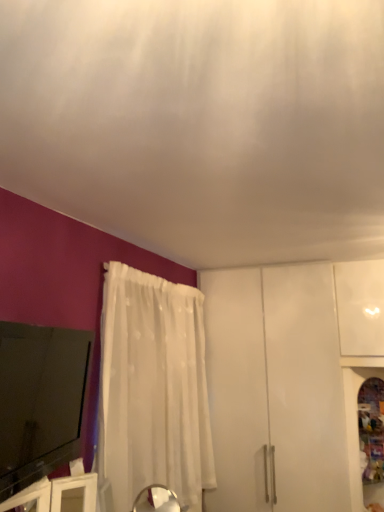
In order to click on white sheer curtain at lower center in this screenshot , I will do `click(201, 124)`.

Identify the location of black glossy tv at lower left. (39, 400).

How far apart are white sheer curtain at lower center and black glossy tv at lower left?

A distance of 31.93 inches exists between white sheer curtain at lower center and black glossy tv at lower left.

Would you say white sheer curtain at lower center is outside black glossy tv at lower left?

Absolutely, white sheer curtain at lower center is external to black glossy tv at lower left.

Considering the relative sizes of white sheer curtain at lower center and black glossy tv at lower left in the image provided, is white sheer curtain at lower center taller than black glossy tv at lower left?

Incorrect, the height of white sheer curtain at lower center is not larger of that of black glossy tv at lower left.

Is white sheer curtain at lower center far away from black glossy tv at lower left?

No, white sheer curtain at lower center is not far from black glossy tv at lower left.

Consider the image. Measure the distance from white sheer curtain at left to white sheer curtain at lower center.

white sheer curtain at left and white sheer curtain at lower center are 1.08 meters apart from each other.

Is point (158, 358) less distant than point (341, 61)?

No.

Is white sheer curtain at left positioned behind white sheer curtain at lower center?

Yes.

Which object is wider, white sheer curtain at left or white sheer curtain at lower center?

white sheer curtain at lower center.

Between white sheer curtain at lower center and white sheer curtain at left, which one appears on the right side from the viewer's perspective?

Positioned to the right is white sheer curtain at lower center.

From a real-world perspective, which object stands above the other?

white sheer curtain at lower center is physically above.

Based on the photo, how much distance is there between white sheer curtain at lower center and white sheer curtain at left?

The distance of white sheer curtain at lower center from white sheer curtain at left is 1.08 meters.

Can you confirm if white sheer curtain at lower center is smaller than white sheer curtain at left?

No, white sheer curtain at lower center is not smaller than white sheer curtain at left.

Considering the relative sizes of white glossy cabinet at lower right and black glossy tv at lower left in the image provided, is white glossy cabinet at lower right taller than black glossy tv at lower left?

Indeed, white glossy cabinet at lower right has a greater height compared to black glossy tv at lower left.

Is white glossy cabinet at lower right aimed at black glossy tv at lower left?

No, white glossy cabinet at lower right is not oriented towards black glossy tv at lower left.

Is white glossy cabinet at lower right in front of or behind black glossy tv at lower left in the image?

In the image, white glossy cabinet at lower right appears behind black glossy tv at lower left.

Considering the positions of point (4, 405) and point (354, 505), is point (4, 405) closer or farther from the camera than point (354, 505)?

Point (4, 405).

From their relative heights in the image, would you say black glossy tv at lower left is taller or shorter than white glossy cabinet at lower right?

black glossy tv at lower left is shorter than white glossy cabinet at lower right.

From a real-world perspective, relative to white glossy cabinet at lower right, is black glossy tv at lower left vertically above or below?

In terms of real-world spatial position, black glossy tv at lower left is above white glossy cabinet at lower right.

Can you tell me how much black glossy tv at lower left and white glossy cabinet at lower right differ in facing direction?

103 degrees.

I want to click on cabinetry that is behind the white sheer curtain at lower center, so click(x=355, y=428).

Which of these two, white glossy cabinet at lower right or white sheer curtain at lower center, is smaller?

white glossy cabinet at lower right is smaller.

Is white glossy cabinet at lower right oriented towards white sheer curtain at lower center?

No, white glossy cabinet at lower right does not turn towards white sheer curtain at lower center.

Can you tell me how much white glossy cabinet at lower right and white sheer curtain at lower center differ in facing direction?

2.49 degrees separate the facing orientations of white glossy cabinet at lower right and white sheer curtain at lower center.

Are black glossy tv at lower left and white sheer curtain at left making contact?

No, black glossy tv at lower left is not in contact with white sheer curtain at left.

Is black glossy tv at lower left turned away from white sheer curtain at left?

No, black glossy tv at lower left's orientation is not away from white sheer curtain at left.

Is point (78, 361) closer to camera compared to point (198, 333)?

Yes, it is.

Does black glossy tv at lower left have a lesser width compared to white sheer curtain at left?

Yes.

You are a GUI agent. You are given a task and a screenshot of the screen. Output one action in this format:
    pyautogui.click(x=<x>, y=<y>)
    Task: Click on the blind in front of the black glossy tv at lower left
    The image size is (384, 512).
    Given the screenshot: What is the action you would take?
    pyautogui.click(x=201, y=124)

There is a white sheer curtain at left. Where is `blind above it (from a real-world perspective)`? This screenshot has height=512, width=384. blind above it (from a real-world perspective) is located at coordinates (201, 124).

Based on their spatial positions, is white sheer curtain at left or white sheer curtain at lower center closer to black glossy tv at lower left?

white sheer curtain at left is positioned closer to the anchor black glossy tv at lower left.

From the image, which object appears to be nearer to white sheer curtain at left, white glossy cabinet at lower right or black glossy tv at lower left?

Among the two, black glossy tv at lower left is located nearer to white sheer curtain at left.

When comparing their distances from white sheer curtain at lower center, does white glossy cabinet at lower right or black glossy tv at lower left seem closer?

black glossy tv at lower left lies closer to white sheer curtain at lower center than the other object.

Considering their positions, is black glossy tv at lower left positioned further to white sheer curtain at left than white glossy cabinet at lower right?

The object further to white sheer curtain at left is white glossy cabinet at lower right.

Considering their positions, is white sheer curtain at lower center positioned further to black glossy tv at lower left than white sheer curtain at left?

The object further to black glossy tv at lower left is white sheer curtain at lower center.

From the image, which object appears to be nearer to white sheer curtain at left, white sheer curtain at lower center or white glossy cabinet at lower right?

white sheer curtain at lower center.

Considering their positions, is white sheer curtain at left positioned closer to white glossy cabinet at lower right than black glossy tv at lower left?

white sheer curtain at left is positioned closer to the anchor white glossy cabinet at lower right.

From the image, which object appears to be farther from white sheer curtain at lower center, white glossy cabinet at lower right or white sheer curtain at left?

white glossy cabinet at lower right.

The height and width of the screenshot is (512, 384). I want to click on curtain located between white sheer curtain at lower center and white glossy cabinet at lower right in the depth direction, so click(x=152, y=389).

Locate an element on the screen. This screenshot has height=512, width=384. electronic between white sheer curtain at lower center and white glossy cabinet at lower right along the z-axis is located at coordinates (39, 400).

Find the location of a particular element. This screenshot has height=512, width=384. curtain situated between black glossy tv at lower left and white glossy cabinet at lower right from left to right is located at coordinates (152, 389).

The width and height of the screenshot is (384, 512). I want to click on electronic located between white sheer curtain at lower center and white sheer curtain at left in the depth direction, so click(x=39, y=400).